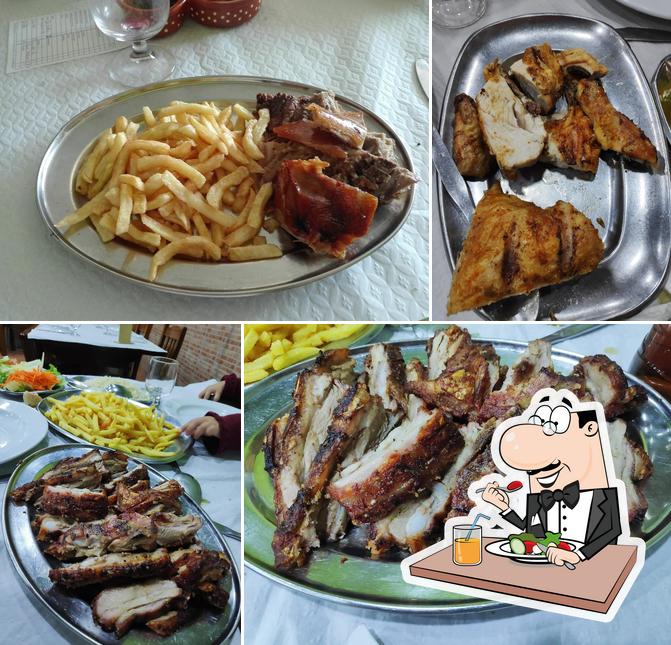
Find the location of a particular element. The width and height of the screenshot is (671, 645). tablecloth is located at coordinates (278, 617).